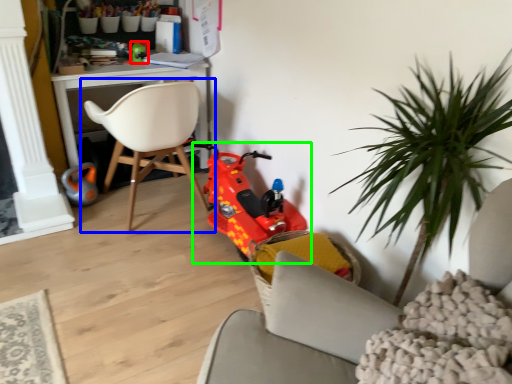
Question: Which object is the farthest from toy (highlighted by a red box)? Choose among these: chair (highlighted by a blue box) or toy (highlighted by a green box).

Choices:
 (A) chair
 (B) toy

Answer: (B)